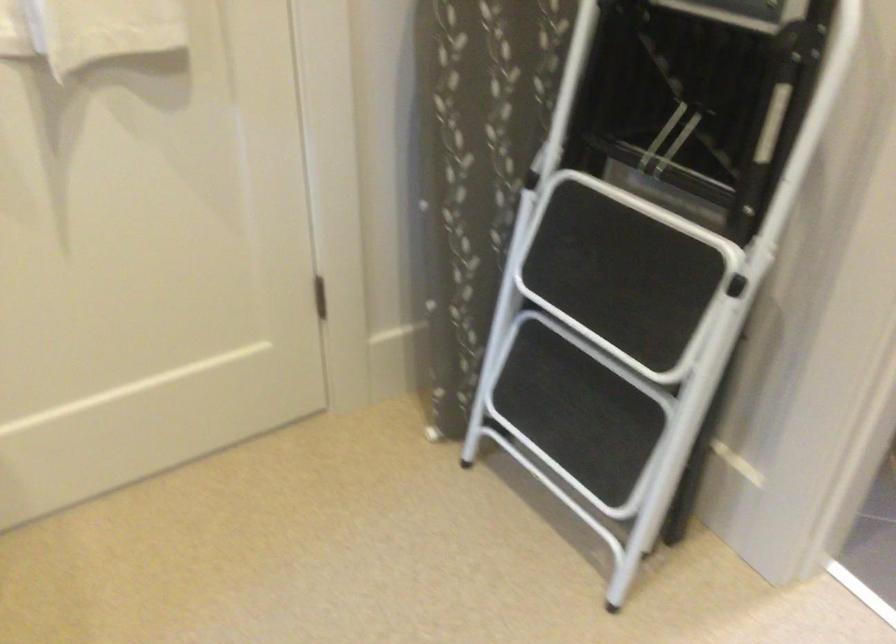
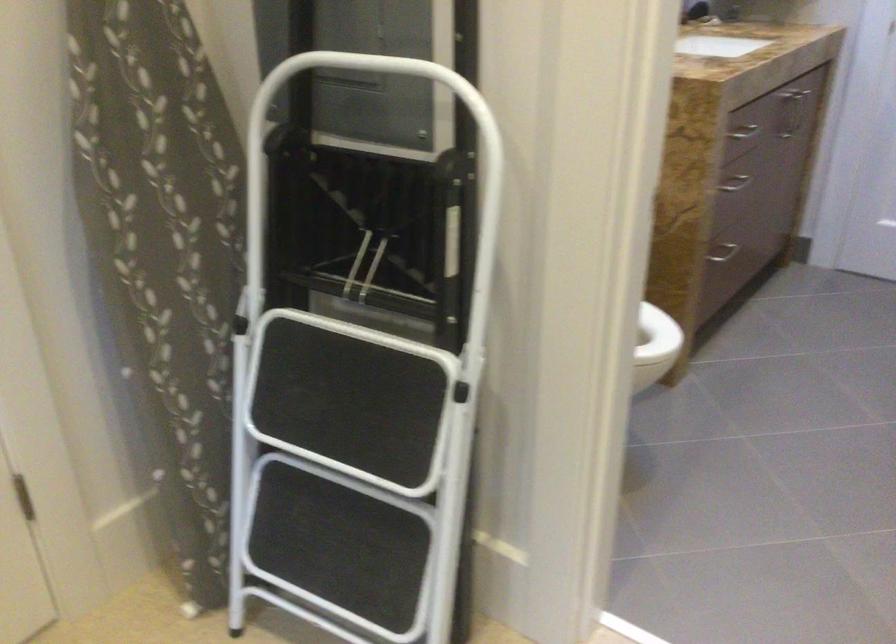
Question: The first image is from the beginning of the video and the second image is from the end. How did the camera likely rotate when shooting the video?

Choices:
 (A) Left
 (B) Right
 (C) Up
 (D) Down

Answer: (B)